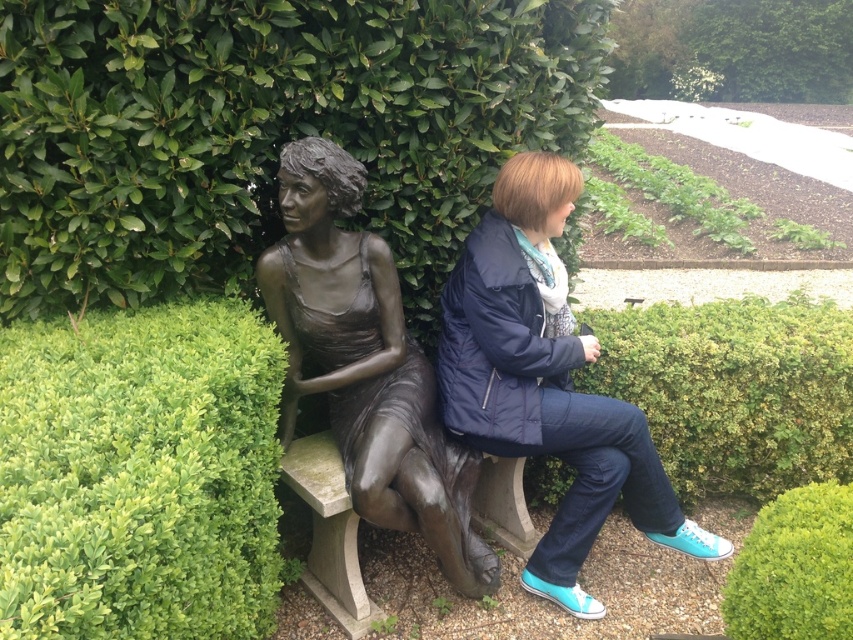
Is bronze statue at center positioned before green leafy hedge at right?

That is True.

The height and width of the screenshot is (640, 853). Describe the element at coordinates (366, 364) in the screenshot. I see `bronze statue at center` at that location.

You are a GUI agent. You are given a task and a screenshot of the screen. Output one action in this format:
    pyautogui.click(x=<x>, y=<y>)
    Task: Click on the bronze statue at center
    The width and height of the screenshot is (853, 640).
    Given the screenshot: What is the action you would take?
    pyautogui.click(x=366, y=364)

Between point (270, 600) and point (659, 20), which one is positioned behind?

The point (659, 20) is more distant.

Who is taller, green leafy hedge at center or green leafy hedge at upper center?

Standing taller between the two is green leafy hedge at center.

Measure the distance between green leafy hedge at center and camera.

green leafy hedge at center and camera are 1.25 meters apart from each other.

Locate an element on the screen. Image resolution: width=853 pixels, height=640 pixels. green leafy hedge at center is located at coordinates (140, 474).

Can you confirm if green leafy hedge at center is wider than matte blue jacket at center?

No, green leafy hedge at center is not wider than matte blue jacket at center.

Is green leafy hedge at center thinner than matte blue jacket at center?

Yes.

This screenshot has height=640, width=853. What are the coordinates of `green leafy hedge at center` in the screenshot? It's located at click(x=140, y=474).